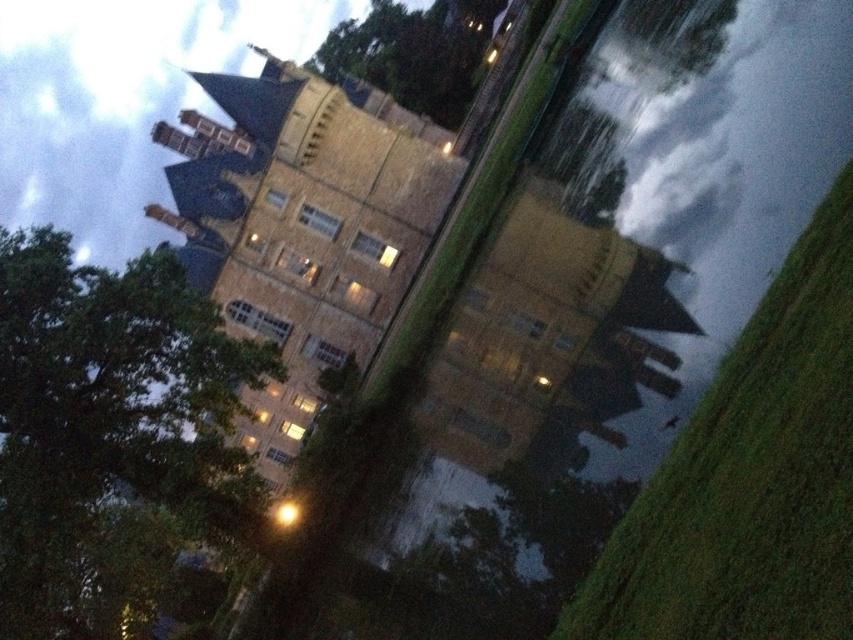
Question: Does green leafy tree at left have a lesser width compared to green leafy tree at upper center?

Choices:
 (A) yes
 (B) no

Answer: (A)

Question: Which point is closer to the camera?

Choices:
 (A) green leafy tree at upper center
 (B) green leafy tree at left

Answer: (B)

Question: Which of the following is the farthest from the observer?

Choices:
 (A) green leafy tree at left
 (B) green leafy tree at upper center

Answer: (B)

Question: Does green leafy tree at left have a lesser width compared to green leafy tree at upper center?

Choices:
 (A) no
 (B) yes

Answer: (B)

Question: Is green leafy tree at left in front of green leafy tree at upper center?

Choices:
 (A) yes
 (B) no

Answer: (A)